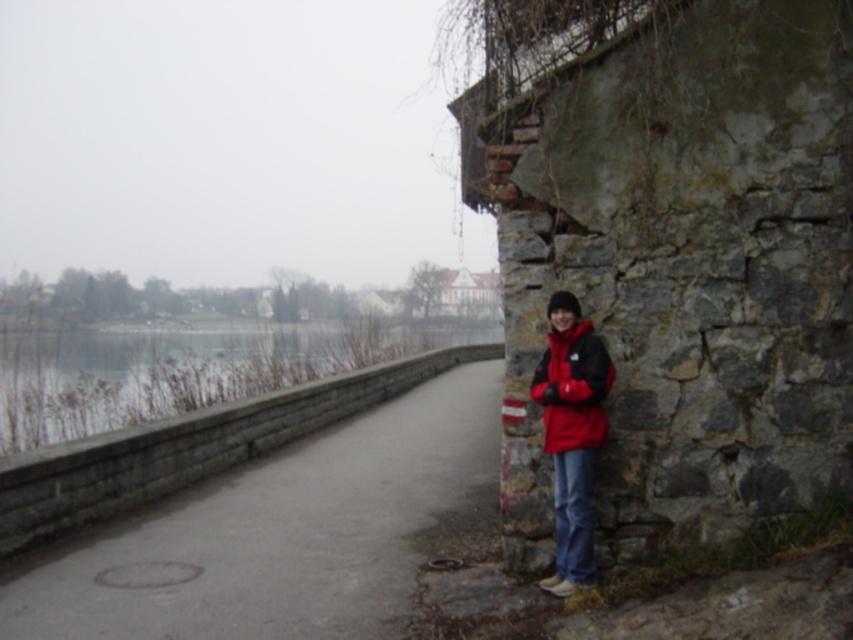
Question: Which point appears farthest from the camera in this image?

Choices:
 (A) (538, 381)
 (B) (96, 392)

Answer: (B)

Question: Is concrete sidewalk at center wider than smooth concrete wall at left?

Choices:
 (A) yes
 (B) no

Answer: (B)

Question: Which of the following is the closest to the observer?

Choices:
 (A) (78, 630)
 (B) (564, 296)
 (C) (606, 364)

Answer: (A)

Question: From the image, what is the correct spatial relationship of concrete sidewalk at center in relation to smooth concrete wall at left?

Choices:
 (A) right
 (B) left

Answer: (A)

Question: Is concrete sidewalk at center wider than smooth concrete wall at left?

Choices:
 (A) yes
 (B) no

Answer: (B)

Question: Which of the following is the closest to the observer?

Choices:
 (A) smooth concrete wall at left
 (B) concrete sidewalk at center
 (C) red matte jacket at lower right

Answer: (B)